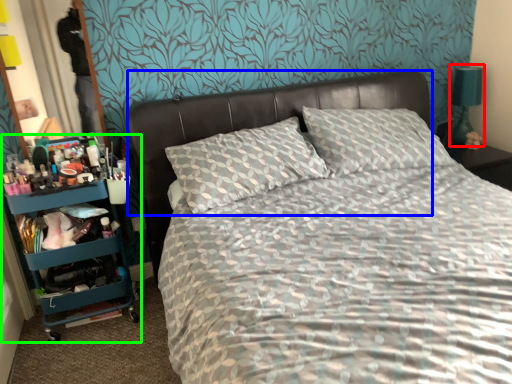
Question: Estimate the real-world distances between objects in this image. Which object is farther from bedside lamp (highlighted by a red box), headboard (highlighted by a blue box) or bookshelf (highlighted by a green box)?

Choices:
 (A) headboard
 (B) bookshelf

Answer: (B)